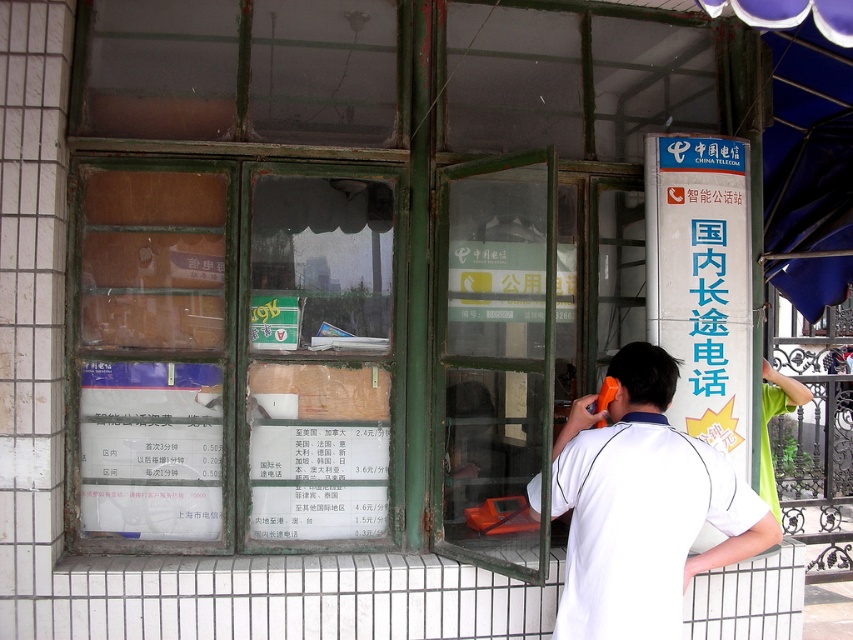
Between transparent glass window at center and white matte shirt at center, which one has less height?

Standing shorter between the two is white matte shirt at center.

Between transparent glass window at center and white matte shirt at center, which one appears on the left side from the viewer's perspective?

Positioned to the left is transparent glass window at center.

Who is more forward, (86, 317) or (645, 513)?

Point (645, 513)

The height and width of the screenshot is (640, 853). Identify the location of transparent glass window at center. (239, 355).